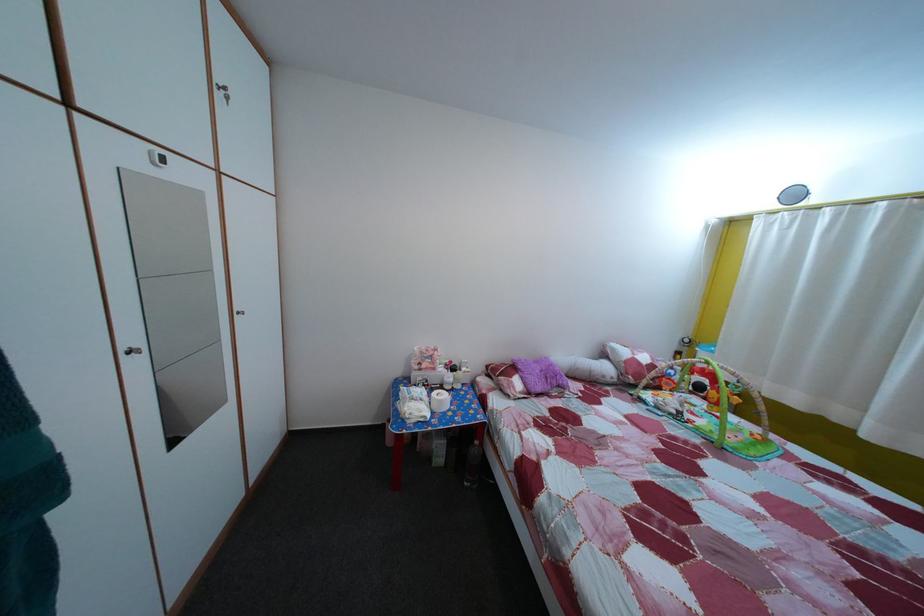
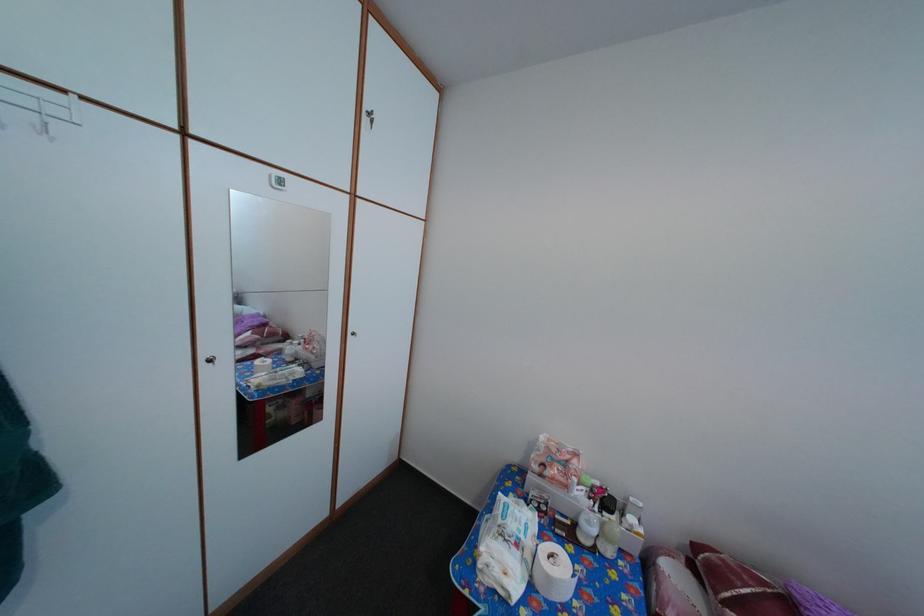
Find the pixel in the second image that matches point 412,428 in the first image.

(484, 572)